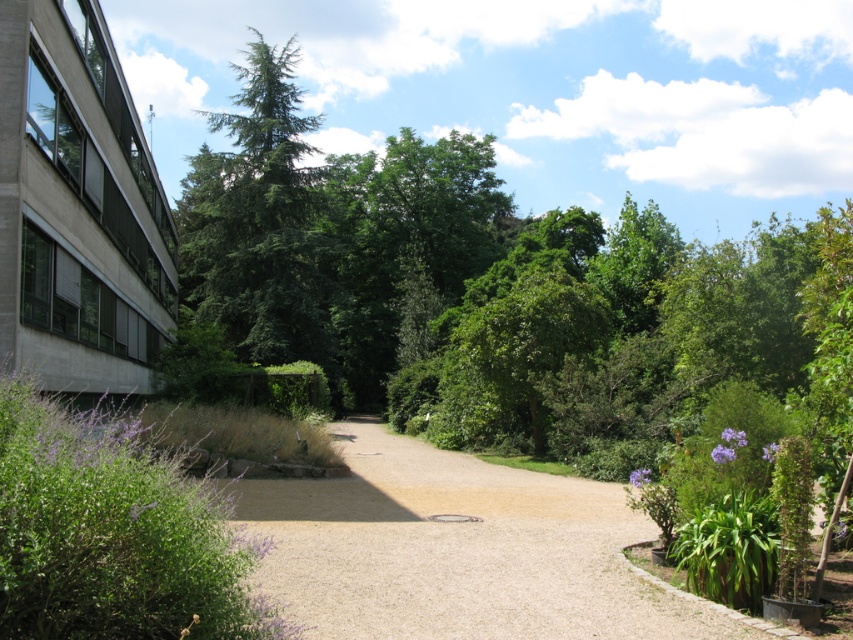
Is point (440, 554) behind point (260, 305)?

No, it is not.

Does light brown gravel driveway at center have a greater width compared to green needle-like tree at upper left?

No.

Does point (546, 499) come farther from viewer compared to point (265, 330)?

No, it is not.

The image size is (853, 640). Find the location of `light brown gravel driveway at center`. light brown gravel driveway at center is located at coordinates (456, 550).